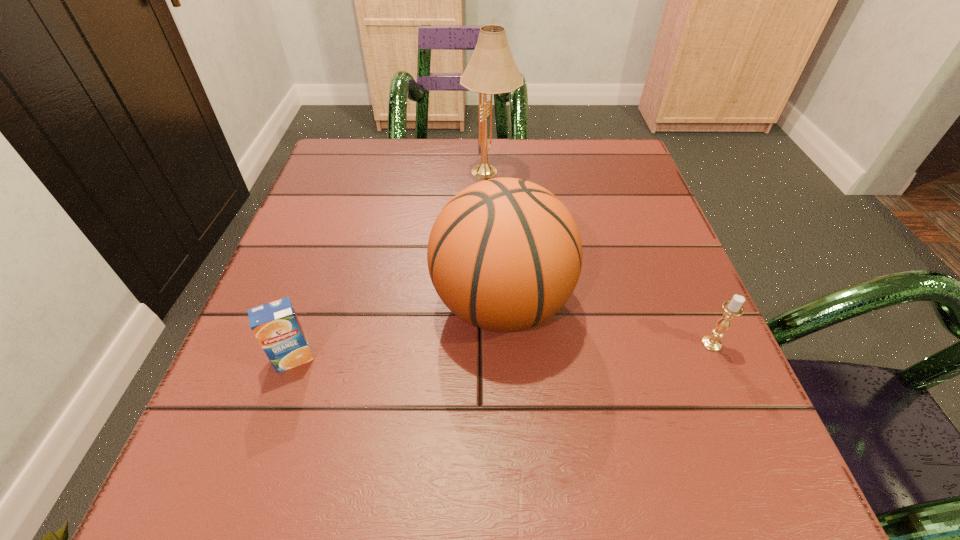
You are a GUI agent. You are given a task and a screenshot of the screen. Output one action in this format:
    pyautogui.click(x=<x>, y=<y>)
    Task: Click on the object present at the left edge
    This screenshot has width=960, height=540.
    Given the screenshot: What is the action you would take?
    pyautogui.click(x=276, y=326)

Identify the location of object that is at the right edge. (732, 308).

Identify the location of free space at the far edge of the desktop. The image size is (960, 540). (521, 172).

This screenshot has width=960, height=540. Find the location of `vacant space at the left edge of the desktop`. vacant space at the left edge of the desktop is located at coordinates [x=343, y=261].

You are a GUI agent. You are given a task and a screenshot of the screen. Output one action in this format:
    pyautogui.click(x=<x>, y=<y>)
    Task: Click on the free spot at the right edge of the desktop
    
    Given the screenshot: What is the action you would take?
    pyautogui.click(x=739, y=403)

Locate an element on the screen. This screenshot has height=540, width=960. vacant area at the far left corner is located at coordinates (391, 138).

Identify the location of vacant region at the far right corner of the desktop. (607, 147).

Find the location of `free spot between the third shortest object and the candle holder`. free spot between the third shortest object and the candle holder is located at coordinates (607, 323).

This screenshot has width=960, height=540. Find the location of `free spot between the farthest object and the leftmost object`. free spot between the farthest object and the leftmost object is located at coordinates (392, 265).

You are a GUI agent. You are given a task and a screenshot of the screen. Output one action in this format:
    pyautogui.click(x=<x>, y=<y>)
    Task: Click on the vacant point located between the orange_juice and the basketball
    The height and width of the screenshot is (540, 960).
    Given the screenshot: What is the action you would take?
    pyautogui.click(x=397, y=331)